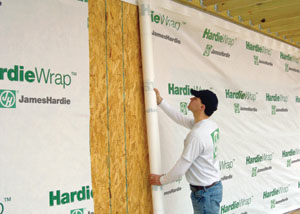
Where is `ceiling`? This screenshot has width=300, height=214. ceiling is located at coordinates (274, 13).